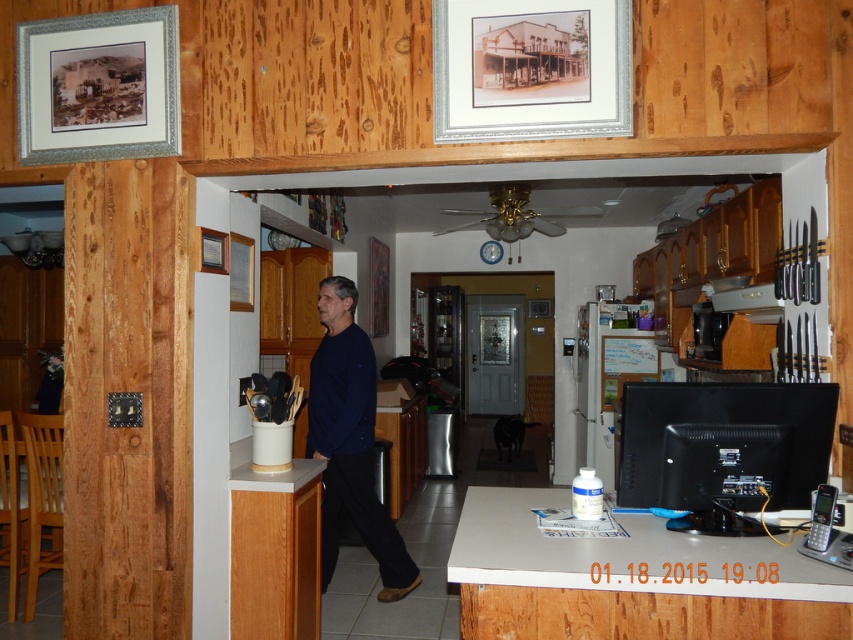
Question: Which point is farther to the camera?

Choices:
 (A) (42, 20)
 (B) (215, 252)
 (C) (527, 61)
 (D) (821, 445)

Answer: (B)

Question: Does silver metallic picture frame at upper left have a lesser width compared to matte black monitor at right?

Choices:
 (A) no
 (B) yes

Answer: (A)

Question: Can you confirm if silver metallic picture frame at upper center is positioned below black matte monitor at lower right?

Choices:
 (A) no
 (B) yes

Answer: (A)

Question: Among these points, which one is farthest from the camera?

Choices:
 (A) (523, 1)
 (B) (611, 456)
 (C) (769, 435)
 (D) (328, 508)

Answer: (B)

Question: Does dark blue sweater at center appear over matte black monitor at right?

Choices:
 (A) no
 (B) yes

Answer: (A)

Question: Which of the following is the farthest from the observer?

Choices:
 (A) matte black monitor at right
 (B) dark blue sweater at center
 (C) wooden picture frame at upper left
 (D) silver metallic picture frame at upper left

Answer: (A)